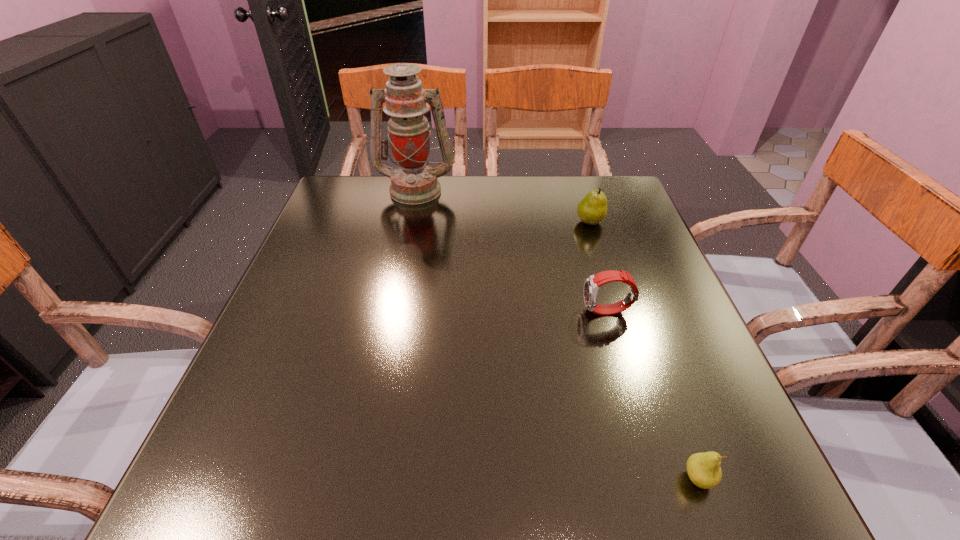
I want to click on vacant space that satisfies the following two spatial constraints: 1. on the back side of the nearest object; 2. on the face of the watch, so click(637, 312).

Where is `vacant space that satisfies the following two spatial constraints: 1. on the face of the watch; 2. on the left side of the nearest object`? Image resolution: width=960 pixels, height=540 pixels. vacant space that satisfies the following two spatial constraints: 1. on the face of the watch; 2. on the left side of the nearest object is located at coordinates (657, 478).

Identify the location of vacant area in the image that satisfies the following two spatial constraints: 1. on the front side of the farther pear; 2. on the right side of the nearest object. This screenshot has width=960, height=540. (672, 478).

Find the location of a particular element. This screenshot has width=960, height=540. vacant space that satisfies the following two spatial constraints: 1. on the face of the watch; 2. on the right side of the nearest object is located at coordinates (657, 478).